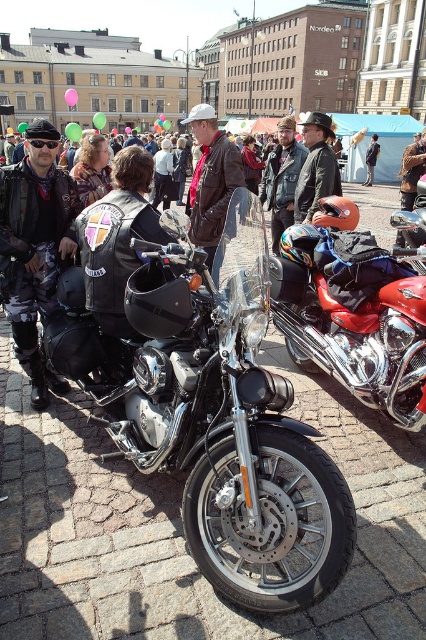
Question: Is polished chrome motorcycle at center behind leather jacket at center?

Choices:
 (A) no
 (B) yes

Answer: (A)

Question: Which point appears closest to the camera in this image?

Choices:
 (A) (302, 216)
 (B) (218, 166)

Answer: (B)

Question: Does polished chrome motorcycle at center have a greater width compared to shiny chrome motorcycle at center?

Choices:
 (A) no
 (B) yes

Answer: (B)

Question: Is polished chrome motorcycle at center wider than shiny chrome motorcycle at center?

Choices:
 (A) no
 (B) yes

Answer: (B)

Question: Among these objects, which one is nearest to the camera?

Choices:
 (A) polished chrome motorcycle at center
 (B) brown leather jacket at center

Answer: (A)

Question: Which point is farther from the camera taking this photo?

Choices:
 (A) (336, 192)
 (B) (203, 403)
 (C) (203, 173)
 (D) (296, 294)

Answer: (A)